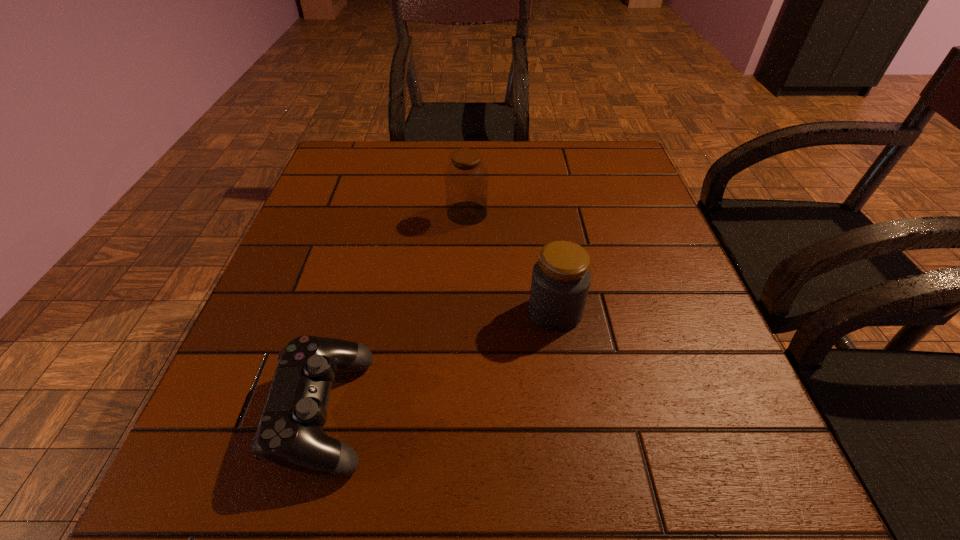
Locate an element on the screen. free space at the far right corner of the desktop is located at coordinates (620, 145).

At what (x,y) coordinates should I click in order to perform the action: click on vacant area at the near right corner. Please return your answer as a coordinate pair (x, y). Looking at the image, I should click on coord(752,475).

At what (x,y) coordinates should I click in order to perform the action: click on vacant point located between the nearest object and the second object from left to right. Please return your answer as a coordinate pair (x, y). The width and height of the screenshot is (960, 540). Looking at the image, I should click on [396, 313].

Where is `blank region between the nearest object and the second object from left to right`? blank region between the nearest object and the second object from left to right is located at coordinates (396, 313).

Image resolution: width=960 pixels, height=540 pixels. What are the coordinates of `vacant region between the second object from left to right and the second farthest object` in the screenshot? It's located at tap(511, 262).

This screenshot has height=540, width=960. Find the location of `vacant space that's between the nearest object and the farthest object`. vacant space that's between the nearest object and the farthest object is located at coordinates (396, 313).

Find the location of a particular element. This screenshot has width=960, height=540. free spot between the farthest object and the control is located at coordinates (396, 313).

The image size is (960, 540). Identify the location of free space that is in between the right jar and the left jar. (511, 262).

Find the location of a particular element. This screenshot has height=540, width=960. empty space between the left jar and the rightmost object is located at coordinates (511, 262).

Identify the location of vacant space in between the right jar and the farthest object. (511, 262).